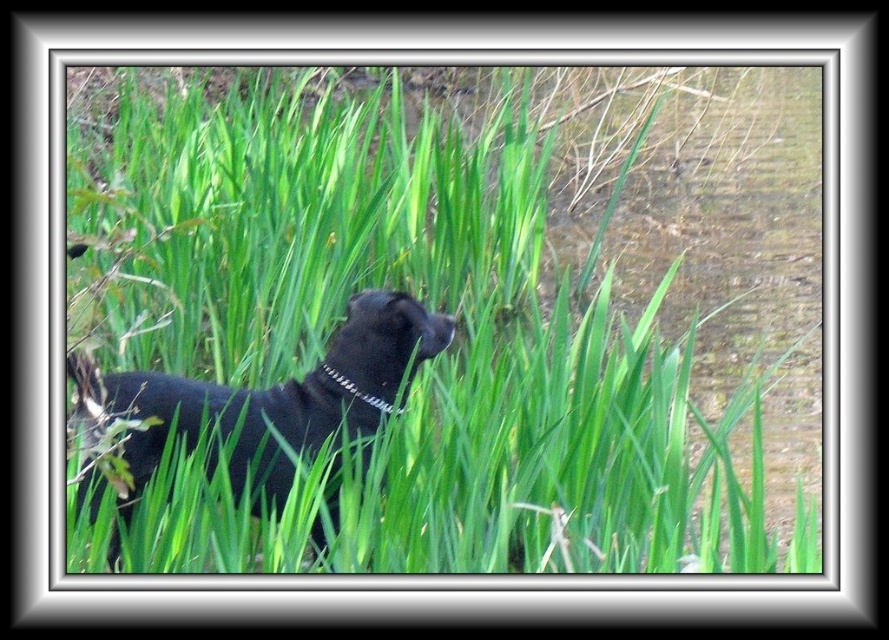
Question: Does green leafy grass at center appear under black matte dog at center?

Choices:
 (A) no
 (B) yes

Answer: (B)

Question: Which of the following is the closest to the observer?

Choices:
 (A) black matte dog at center
 (B) green leafy grass at center

Answer: (A)

Question: Considering the relative positions of green leafy grass at center and black matte dog at center in the image provided, where is green leafy grass at center located with respect to black matte dog at center?

Choices:
 (A) right
 (B) left

Answer: (A)

Question: Is green leafy grass at center bigger than black matte dog at center?

Choices:
 (A) yes
 (B) no

Answer: (A)

Question: Which of the following is the farthest from the observer?

Choices:
 (A) (169, 378)
 (B) (638, 352)

Answer: (B)